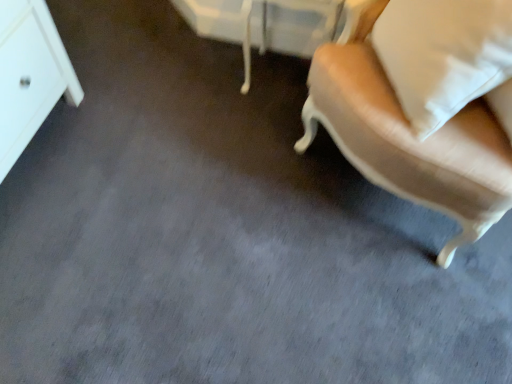
Question: Is point (444, 147) closer or farther from the camera than point (326, 0)?

Choices:
 (A) closer
 (B) farther

Answer: (A)

Question: Considering the positions of beige fabric chair at right and white glossy vanity at upper center in the image, is beige fabric chair at right taller or shorter than white glossy vanity at upper center?

Choices:
 (A) short
 (B) tall

Answer: (B)

Question: Based on their relative distances, which object is farther from the white glossy vanity at upper center?

Choices:
 (A) beige fabric chair at right
 (B) white soft pillow at upper right

Answer: (B)

Question: Which object is the farthest from the white soft pillow at upper right?

Choices:
 (A) white glossy vanity at upper center
 (B) beige fabric chair at right

Answer: (A)